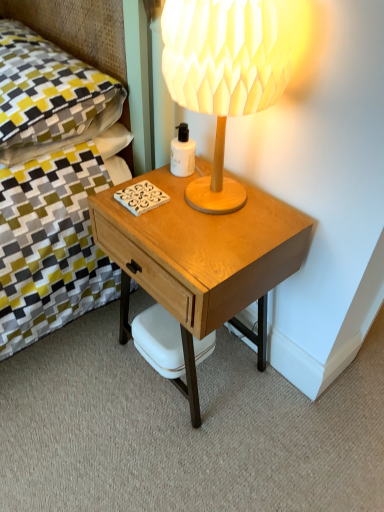
Question: Is white matte bottle at center facing away from white matte coffee cup at lower center?

Choices:
 (A) no
 (B) yes

Answer: (A)

Question: Does white matte bottle at center have a larger size compared to white matte coffee cup at lower center?

Choices:
 (A) no
 (B) yes

Answer: (A)

Question: Considering the relative sizes of white matte bottle at center and white matte coffee cup at lower center in the image provided, is white matte bottle at center shorter than white matte coffee cup at lower center?

Choices:
 (A) no
 (B) yes

Answer: (A)

Question: Is white matte bottle at center with white matte coffee cup at lower center?

Choices:
 (A) yes
 (B) no

Answer: (B)

Question: Is white matte bottle at center at the left side of white matte coffee cup at lower center?

Choices:
 (A) no
 (B) yes

Answer: (A)

Question: From a real-world perspective, relative to light brown wood desk at center, is white matte coffee cup at lower center vertically above or below?

Choices:
 (A) below
 (B) above

Answer: (A)

Question: Is point (147, 309) positioned closer to the camera than point (274, 276)?

Choices:
 (A) farther
 (B) closer

Answer: (A)

Question: Is white matte coffee cup at lower center wider or thinner than light brown wood desk at center?

Choices:
 (A) thin
 (B) wide

Answer: (A)

Question: From the image's perspective, is white matte coffee cup at lower center located above or below light brown wood desk at center?

Choices:
 (A) below
 (B) above

Answer: (A)

Question: In the image, is light brown wood desk at center positioned in front of or behind white matte bottle at center?

Choices:
 (A) behind
 (B) front

Answer: (B)

Question: Would you say light brown wood desk at center is inside or outside white matte bottle at center?

Choices:
 (A) outside
 (B) inside

Answer: (A)

Question: Is point (259, 215) positioned closer to the camera than point (178, 166)?

Choices:
 (A) farther
 (B) closer

Answer: (B)

Question: In terms of height, does light brown wood desk at center look taller or shorter compared to white matte bottle at center?

Choices:
 (A) tall
 (B) short

Answer: (A)

Question: From the image's perspective, relative to wooden lampshade at upper right, is light brown wood desk at center above or below?

Choices:
 (A) below
 (B) above

Answer: (A)

Question: Considering their positions, is light brown wood desk at center located in front of or behind wooden lampshade at upper right?

Choices:
 (A) behind
 (B) front

Answer: (A)